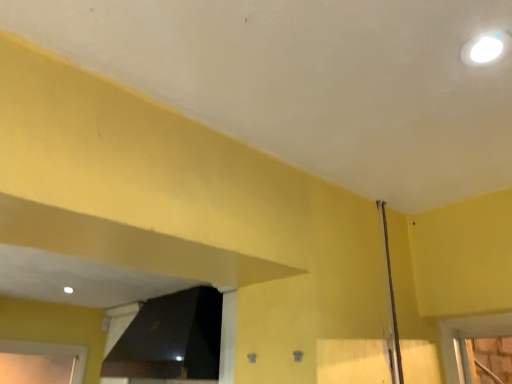
In order to face black glass window at lower center, should I rotate leftwards or rightwards?

You should rotate left by 10.387 degrees.

The image size is (512, 384). Describe the element at coordinates (170, 338) in the screenshot. I see `black glass window at lower center` at that location.

Where is `black glass window at lower center`? The height and width of the screenshot is (384, 512). black glass window at lower center is located at coordinates point(170,338).

Find the location of `black glass window at lower center`. black glass window at lower center is located at coordinates (170, 338).